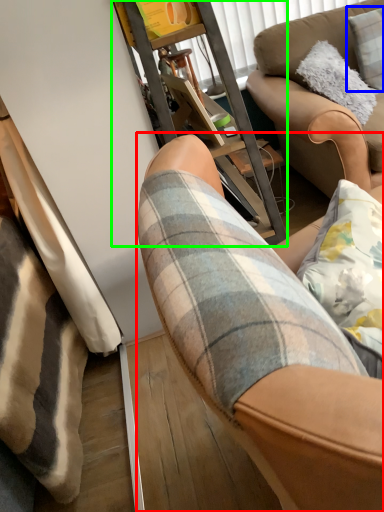
Question: Estimate the real-world distances between objects in this image. Which object is farther from chair (highlighted by a red box), pillow (highlighted by a blue box) or furniture (highlighted by a green box)?

Choices:
 (A) pillow
 (B) furniture

Answer: (A)